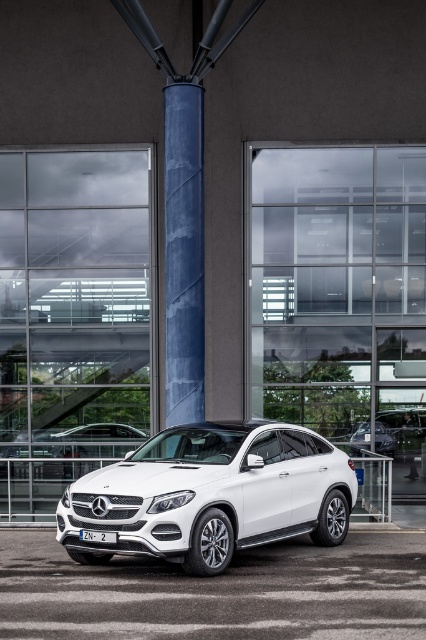
Based on the photo, which is below, white metallic car at center or blue textured column at center?

Positioned lower is white metallic car at center.

Who is taller, white metallic car at center or blue textured column at center?

Standing taller between the two is blue textured column at center.

Is point (103, 525) positioned in front of point (175, 106)?

Yes, it is.

Where is `white metallic car at center`? The height and width of the screenshot is (640, 426). white metallic car at center is located at coordinates (210, 496).

Is white glossy parking lot at center shorter than blue textured column at center?

Yes, white glossy parking lot at center is shorter than blue textured column at center.

The width and height of the screenshot is (426, 640). In order to click on white glossy parking lot at center in this screenshot , I will do `click(218, 592)`.

Does white glossy parking lot at center appear on the right side of white metallic car at center?

Yes, white glossy parking lot at center is to the right of white metallic car at center.

Consider the image. Who is shorter, white glossy parking lot at center or white metallic car at center?

white glossy parking lot at center

Does point (267, 595) come in front of point (195, 468)?

Yes, it is.

The image size is (426, 640). What are the coordinates of `white glossy parking lot at center` in the screenshot? It's located at (218, 592).